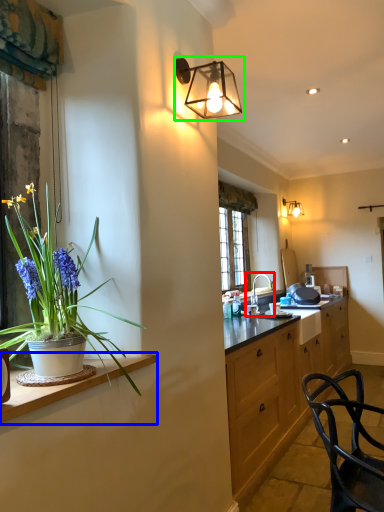
Question: Which object is positioned closest to sink (highlighted by a red box)? Select from countertop (highlighted by a blue box) and lamp (highlighted by a green box).

Choices:
 (A) countertop
 (B) lamp

Answer: (B)